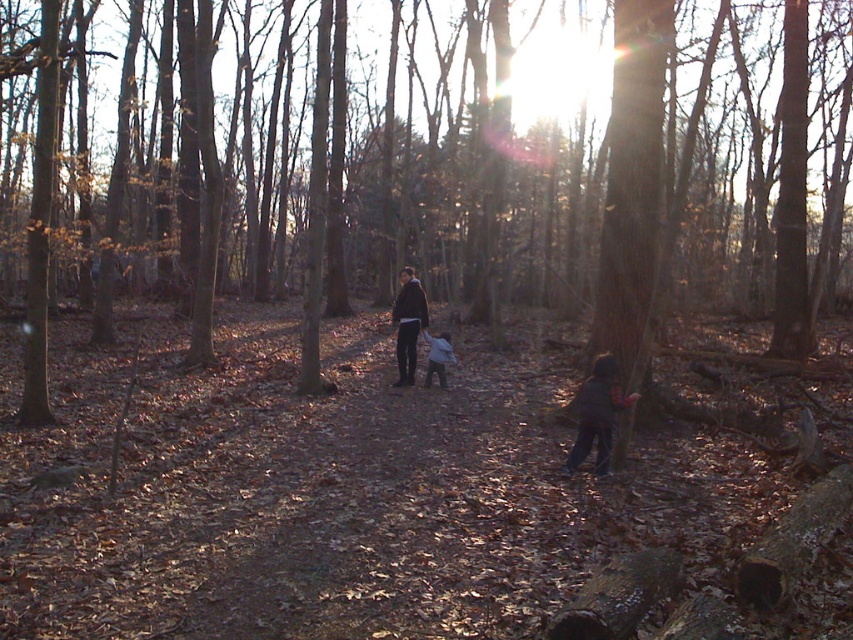
You are a parent searching for your child in the forest. You see the dark blue fleece jacket at lower right. Based on its position, can you estimate how far it is from the center of the image?

The dark blue fleece jacket at lower right is located at point (x=596, y=416), which means it is approximately 35.0 centimeters away from the center of the image.

You are a hiker trying to locate two points in the forest. The first point is at coordinates point (204, 228) and the second point is at point (618, 401). Which point is closer to you?

Point (204, 228) is closer to you because it is further to the viewer than point (618, 401).

You are a parent searching for your children in the forest. You see two items of clothing, the dark blue fleece jacket at lower right and the light blue fabric at center. Which clothing item is taller?

The dark blue fleece jacket at lower right is much taller than the light blue fabric at center.